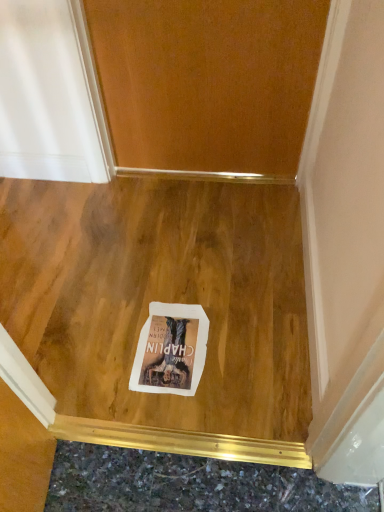
Identify the location of vacant space situated on the left part of white paper postcard at center. This screenshot has width=384, height=512. (99, 353).